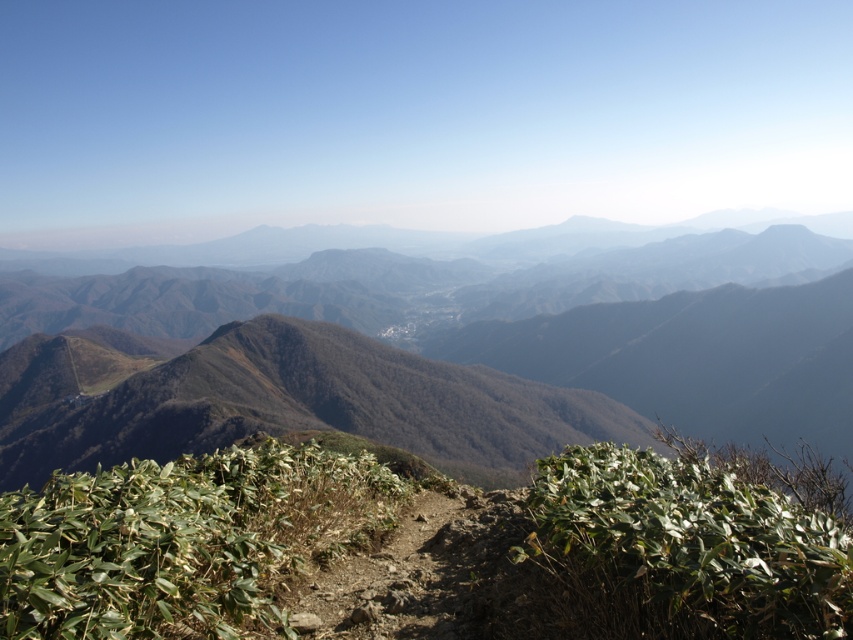
Looking at this image, measure the distance from green leafy shrub at center to green leafy plant at center.

green leafy shrub at center and green leafy plant at center are 22.86 feet apart from each other.

Does green leafy shrub at center appear under green leafy plant at center?

Correct, green leafy shrub at center is located below green leafy plant at center.

At what (x,y) coordinates should I click in order to perform the action: click on green leafy shrub at center. Please return your answer as a coordinate pair (x, y). The image size is (853, 640). Looking at the image, I should click on (183, 540).

Image resolution: width=853 pixels, height=640 pixels. Find the location of `green leafy shrub at center`. green leafy shrub at center is located at coordinates pos(183,540).

Which is behind, point (575, 282) or point (576, 456)?

The point (575, 282) is behind.

Who is taller, brown/drymaterial/texture mountain range at center or green leafy plant at center?

brown/drymaterial/texture mountain range at center

Locate an element on the screen. This screenshot has width=853, height=640. brown/drymaterial/texture mountain range at center is located at coordinates (439, 353).

Who is more forward, (685,401) or (177,586)?

Point (177,586)

Is brown/drymaterial/texture mountain range at center thinner than green leafy shrub at center?

Incorrect, brown/drymaterial/texture mountain range at center's width is not less than green leafy shrub at center's.

Is point (561, 412) closer to camera compared to point (242, 627)?

That is False.

The height and width of the screenshot is (640, 853). Find the location of `brown/drymaterial/texture mountain range at center`. brown/drymaterial/texture mountain range at center is located at coordinates (439, 353).